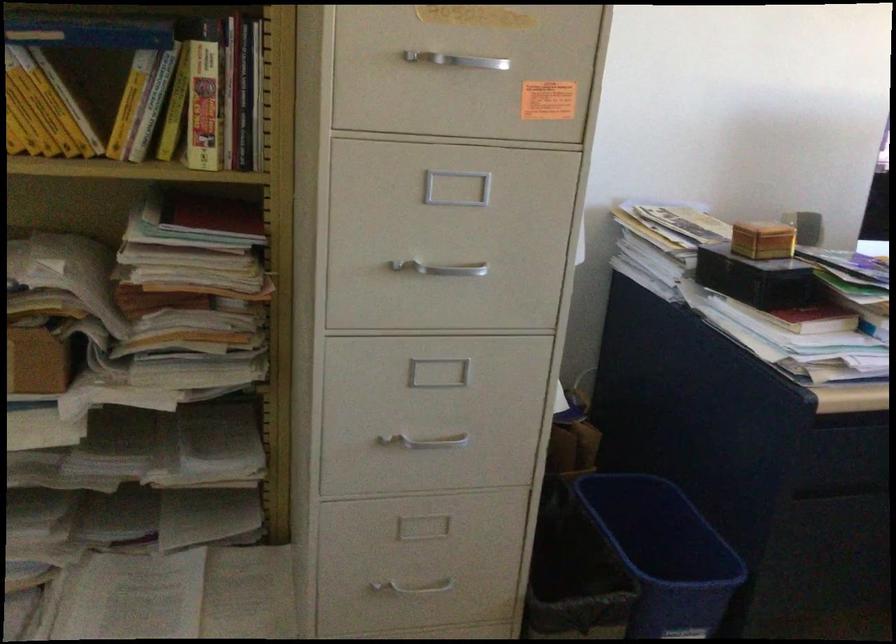
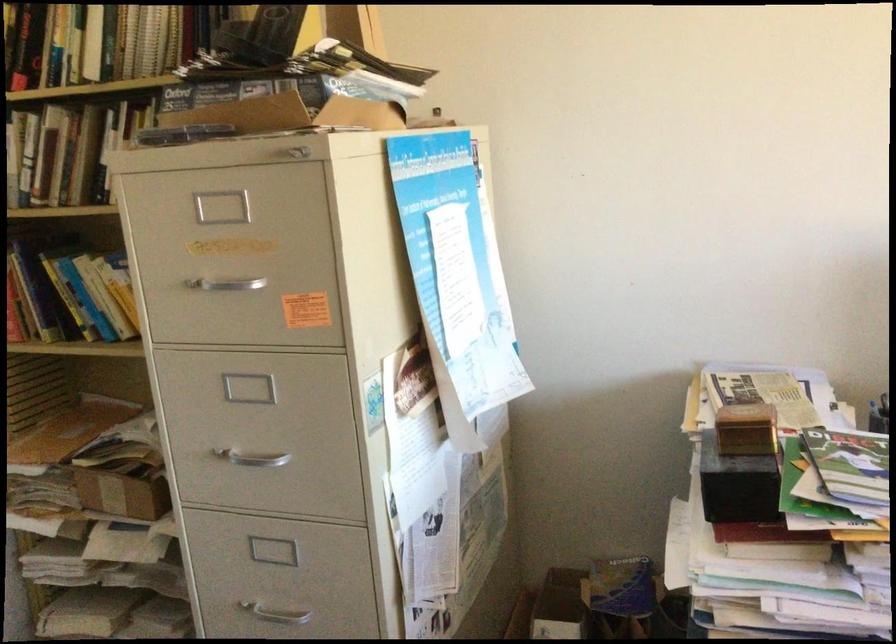
Find the pixel in the second image that matches (x=418, y=433) in the first image.

(273, 608)